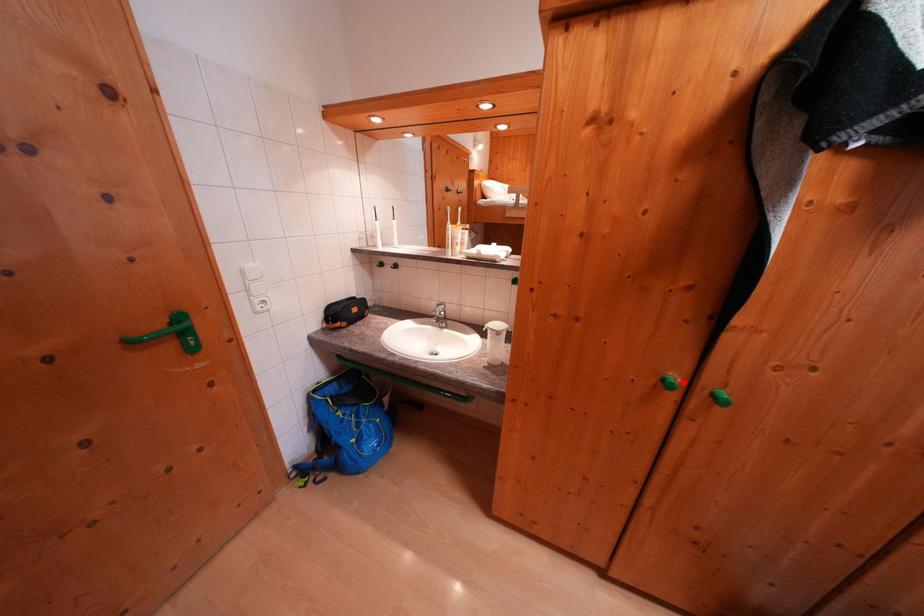
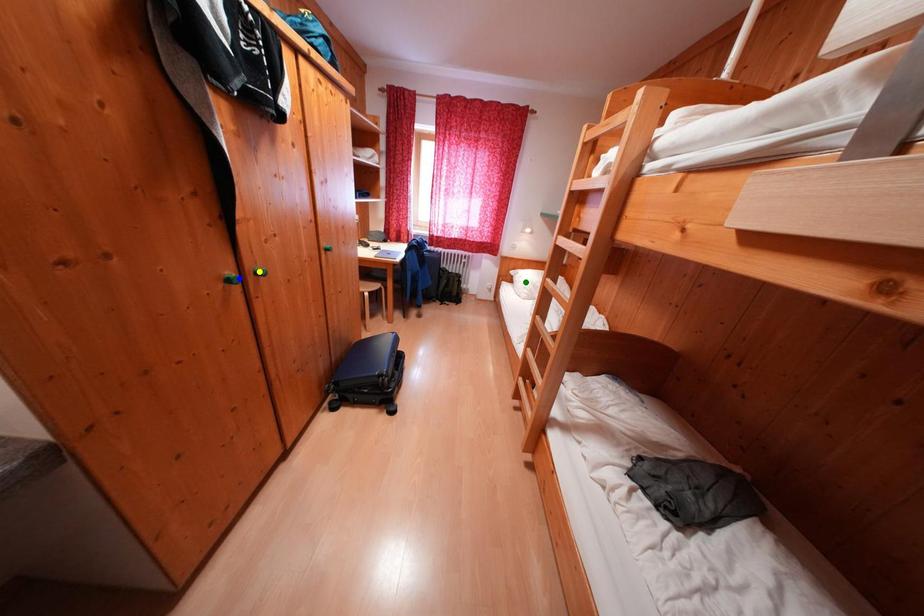
Question: I am providing you with two images of the same scene from different viewpoints. A red point is marked on the first image. You are given multiple points on the second image. Which point in image 2 is actually the same real-world point as the red point in image 1?

Choices:
 (A) blue point
 (B) green point
 (C) yellow point

Answer: (A)